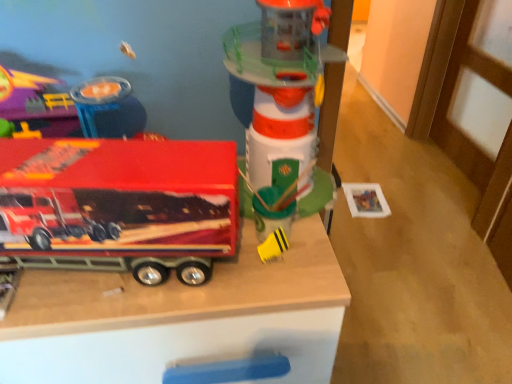
The width and height of the screenshot is (512, 384). I want to click on metallic red truck at left, the second toy from the left, so click(121, 202).

This screenshot has width=512, height=384. Describe the element at coordinates (273, 246) in the screenshot. I see `yellow rubber duck at center, the 3th toy viewed from the left` at that location.

From the picture: Measure the distance between wooden toy truck at center and camera.

wooden toy truck at center and camera are 22.32 inches apart from each other.

Image resolution: width=512 pixels, height=384 pixels. Find the location of `shiny red truck at left, the first toy positioned from the left`. shiny red truck at left, the first toy positioned from the left is located at coordinates (70, 107).

From the image's perspective, between yellow rubber duck at center, which is counted as the 2th toy, starting from the right, and translucent plastic lighthouse at center, the 4th toy viewed from the left, who is located below?

yellow rubber duck at center, which is counted as the 2th toy, starting from the right, appears lower in the image.

Could you tell me if yellow rubber duck at center, which is counted as the 2th toy, starting from the right, is facing translucent plastic lighthouse at center, the first toy when ordered from right to left?

No, yellow rubber duck at center, which is counted as the 2th toy, starting from the right, is not facing towards translucent plastic lighthouse at center, the first toy when ordered from right to left.

Considering the positions of point (283, 236) and point (280, 109), is point (283, 236) closer or farther from the camera than point (280, 109)?

Point (283, 236) is farther from the camera than point (280, 109).

Looking at this image, considering the relative sizes of yellow rubber duck at center, the 3th toy viewed from the left, and translucent plastic lighthouse at center, the first toy when ordered from right to left, in the image provided, is yellow rubber duck at center, the 3th toy viewed from the left, thinner than translucent plastic lighthouse at center, the first toy when ordered from right to left,?

Correct, the width of yellow rubber duck at center, the 3th toy viewed from the left, is less than that of translucent plastic lighthouse at center, the first toy when ordered from right to left.

From a real-world perspective, who is located lower, shiny red truck at left, positioned as the fourth toy in right-to-left order, or yellow rubber duck at center, the 3th toy viewed from the left?

In real-world perspective, yellow rubber duck at center, the 3th toy viewed from the left, is lower.

Considering the sizes of objects shiny red truck at left, the first toy positioned from the left, and yellow rubber duck at center, the 3th toy viewed from the left, in the image provided, who is wider, shiny red truck at left, the first toy positioned from the left, or yellow rubber duck at center, the 3th toy viewed from the left,?

shiny red truck at left, the first toy positioned from the left.

Does shiny red truck at left, positioned as the fourth toy in right-to-left order, touch yellow rubber duck at center, the 3th toy viewed from the left?

There is a gap between shiny red truck at left, positioned as the fourth toy in right-to-left order, and yellow rubber duck at center, the 3th toy viewed from the left.

Locate an element on the screen. The width and height of the screenshot is (512, 384). the 2nd toy positioned below the shiny red truck at left, positioned as the fourth toy in right-to-left order (from the image's perspective) is located at coordinates (273, 246).

Does point (280, 290) appear closer or farther from the camera than point (178, 155)?

Point (280, 290) is positioned farther from the camera compared to point (178, 155).

From a real-world perspective, which is physically below, wooden toy truck at center or metallic red truck at left, the second toy from the left?

wooden toy truck at center.

In the scene shown: Between wooden toy truck at center and metallic red truck at left, the third toy positioned from the right, which one has less height?

With less height is metallic red truck at left, the third toy positioned from the right.

Who is smaller, metallic red truck at left, the second toy from the left, or translucent plastic lighthouse at center, the first toy when ordered from right to left?

translucent plastic lighthouse at center, the first toy when ordered from right to left.

Is metallic red truck at left, the second toy from the left, at the right side of translucent plastic lighthouse at center, the 4th toy viewed from the left?

No, metallic red truck at left, the second toy from the left, is not to the right of translucent plastic lighthouse at center, the 4th toy viewed from the left.

Which point is more forward, [155,153] or [289,96]?

The point [155,153] is closer to the camera.

From the image's perspective, does wooden toy truck at center appear lower than translucent plastic lighthouse at center, the first toy when ordered from right to left?

Yes.

How distant is wooden toy truck at center from translucent plastic lighthouse at center, the 4th toy viewed from the left?

wooden toy truck at center is 23.98 centimeters away from translucent plastic lighthouse at center, the 4th toy viewed from the left.

Consider the image. Which of these two, wooden toy truck at center or translucent plastic lighthouse at center, the first toy when ordered from right to left, is bigger?

wooden toy truck at center.

Between wooden toy truck at center and translucent plastic lighthouse at center, the 4th toy viewed from the left, which one has smaller width?

translucent plastic lighthouse at center, the 4th toy viewed from the left.

Who is smaller, shiny red truck at left, positioned as the fourth toy in right-to-left order, or metallic red truck at left, the second toy from the left?

shiny red truck at left, positioned as the fourth toy in right-to-left order.

Does shiny red truck at left, positioned as the fourth toy in right-to-left order, have a greater height compared to metallic red truck at left, the second toy from the left?

No.

Can you tell me how much shiny red truck at left, positioned as the fourth toy in right-to-left order, and metallic red truck at left, the second toy from the left, differ in facing direction?

There is a 4.97-degree angle between the facing directions of shiny red truck at left, positioned as the fourth toy in right-to-left order, and metallic red truck at left, the second toy from the left.

Is shiny red truck at left, positioned as the fourth toy in right-to-left order, not near metallic red truck at left, the second toy from the left?

They are positioned close to each other.

Is wooden toy truck at center completely or partially inside yellow rubber duck at center, which is counted as the 2th toy, starting from the right?

That's incorrect, wooden toy truck at center is not inside yellow rubber duck at center, which is counted as the 2th toy, starting from the right.

Can you confirm if yellow rubber duck at center, which is counted as the 2th toy, starting from the right, is shorter than wooden toy truck at center?

Yes.

How many degrees apart are the facing directions of yellow rubber duck at center, the 3th toy viewed from the left, and wooden toy truck at center?

The facing directions of yellow rubber duck at center, the 3th toy viewed from the left, and wooden toy truck at center are 25 degrees apart.

From a real-world perspective, is yellow rubber duck at center, which is counted as the 2th toy, starting from the right, positioned above or below wooden toy truck at center?

Clearly, from a real-world perspective, yellow rubber duck at center, which is counted as the 2th toy, starting from the right, is above wooden toy truck at center.

Locate an element on the screen. the 2nd toy behind the translucent plastic lighthouse at center, the first toy when ordered from right to left is located at coordinates (273, 246).

Image resolution: width=512 pixels, height=384 pixels. There is a yellow rubber duck at center, the 3th toy viewed from the left. Find the location of `the 2nd toy above it (from a real-world perspective)`. the 2nd toy above it (from a real-world perspective) is located at coordinates (70, 107).

From the image, which object appears to be nearer to shiny red truck at left, the first toy positioned from the left, translucent plastic lighthouse at center, the first toy when ordered from right to left, or yellow rubber duck at center, the 3th toy viewed from the left?

Based on the image, translucent plastic lighthouse at center, the first toy when ordered from right to left, appears to be nearer to shiny red truck at left, the first toy positioned from the left.

From the image, which object appears to be farther from yellow rubber duck at center, the 3th toy viewed from the left, metallic red truck at left, the third toy positioned from the right, or shiny red truck at left, positioned as the fourth toy in right-to-left order?

shiny red truck at left, positioned as the fourth toy in right-to-left order, is positioned further to the anchor yellow rubber duck at center, the 3th toy viewed from the left.

Estimate the real-world distances between objects in this image. Which object is closer to yellow rubber duck at center, which is counted as the 2th toy, starting from the right, shiny red truck at left, the first toy positioned from the left, or translucent plastic lighthouse at center, the first toy when ordered from right to left?

Among the two, translucent plastic lighthouse at center, the first toy when ordered from right to left, is located nearer to yellow rubber duck at center, which is counted as the 2th toy, starting from the right.

Considering their positions, is wooden toy truck at center positioned further to shiny red truck at left, positioned as the fourth toy in right-to-left order, than metallic red truck at left, the second toy from the left?

wooden toy truck at center is further to shiny red truck at left, positioned as the fourth toy in right-to-left order.

Consider the image. Which object lies further to the anchor point metallic red truck at left, the third toy positioned from the right, wooden toy truck at center or yellow rubber duck at center, which is counted as the 2th toy, starting from the right?

Based on the image, yellow rubber duck at center, which is counted as the 2th toy, starting from the right, appears to be further to metallic red truck at left, the third toy positioned from the right.

Looking at this image, which object lies nearer to the anchor point yellow rubber duck at center, the 3th toy viewed from the left, shiny red truck at left, the first toy positioned from the left, or wooden toy truck at center?

Based on the image, wooden toy truck at center appears to be nearer to yellow rubber duck at center, the 3th toy viewed from the left.

From the image, which object appears to be nearer to metallic red truck at left, the third toy positioned from the right, translucent plastic lighthouse at center, the first toy when ordered from right to left, or wooden toy truck at center?

wooden toy truck at center is closer to metallic red truck at left, the third toy positioned from the right.

When comparing their distances from wooden toy truck at center, does translucent plastic lighthouse at center, the first toy when ordered from right to left, or shiny red truck at left, positioned as the fourth toy in right-to-left order, seem further?

Among the two, shiny red truck at left, positioned as the fourth toy in right-to-left order, is located further to wooden toy truck at center.

I want to click on toy between metallic red truck at left, the second toy from the left, and wooden toy truck at center from top to bottom, so click(x=273, y=246).

This screenshot has height=384, width=512. In order to click on toy between shiny red truck at left, the first toy positioned from the left, and yellow rubber duck at center, which is counted as the 2th toy, starting from the right, from left to right in this screenshot , I will do `click(121, 202)`.

The width and height of the screenshot is (512, 384). In order to click on toy between metallic red truck at left, the third toy positioned from the right, and translucent plastic lighthouse at center, the first toy when ordered from right to left, in the horizontal direction in this screenshot , I will do `click(273, 246)`.